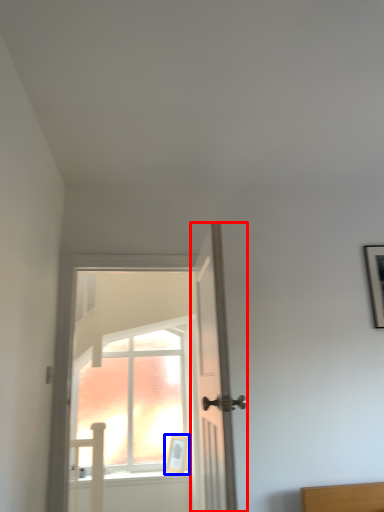
Question: Which point is closer to the camera, door (highlighted by a red box) or picture frame (highlighted by a blue box)?

Choices:
 (A) door
 (B) picture frame

Answer: (A)